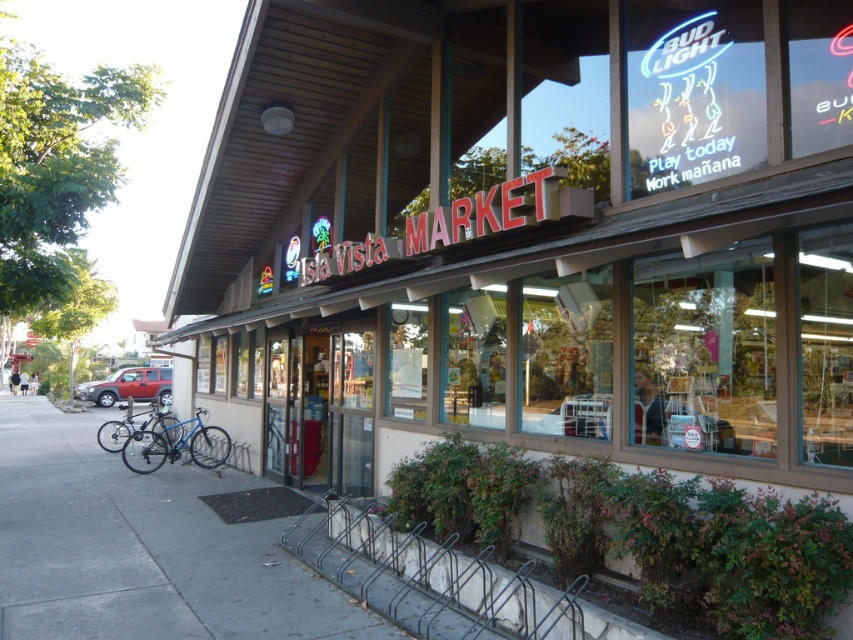
Question: Is gray concrete bike rack at lower center smaller than matte red suv at lower left?

Choices:
 (A) yes
 (B) no

Answer: (B)

Question: Among these points, which one is nearest to the camera?

Choices:
 (A) coord(100,440)
 (B) coord(228,445)
 (C) coord(537,602)

Answer: (C)

Question: Can you confirm if matte red suv at lower left is thinner than blue matte bicycle at lower left?

Choices:
 (A) yes
 (B) no

Answer: (A)

Question: Estimate the real-world distances between objects in this image. Which object is farther from the gray concrete bike rack at lower center?

Choices:
 (A) blue metallic bicycle at lower left
 (B) blue matte bicycle at lower left

Answer: (B)

Question: Where is gray concrete bike rack at lower center located in relation to matte red suv at lower left in the image?

Choices:
 (A) above
 (B) below

Answer: (A)

Question: Which point appears farthest from the camera in this image?

Choices:
 (A) (152, 380)
 (B) (554, 634)
 (C) (154, 452)

Answer: (A)